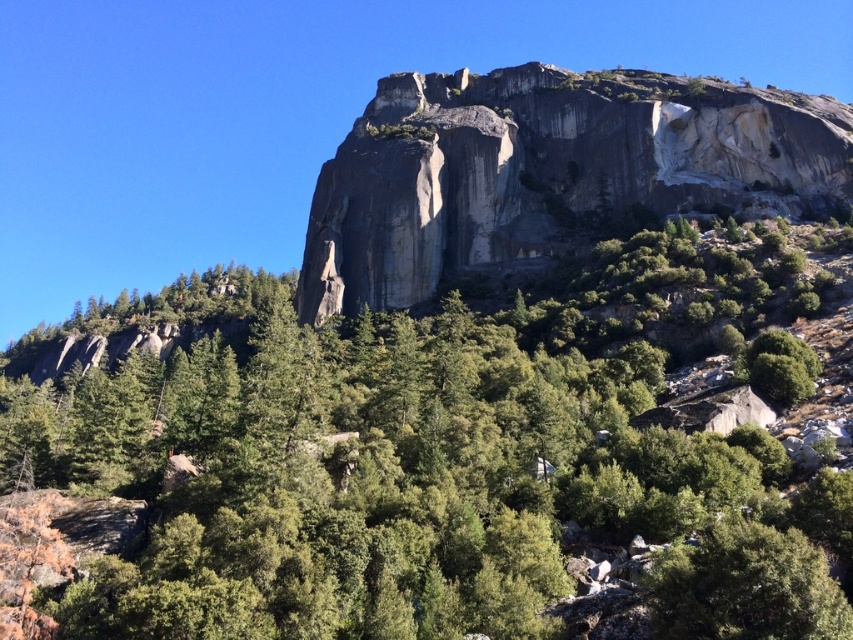
Question: Is green leafy tree at center further to the viewer compared to gray rock formation at upper center?

Choices:
 (A) yes
 (B) no

Answer: (B)

Question: Is green leafy tree at center closer to camera compared to gray rock formation at upper center?

Choices:
 (A) no
 (B) yes

Answer: (B)

Question: Which point is farther from the camera taking this photo?

Choices:
 (A) (843, 476)
 (B) (445, 209)

Answer: (B)

Question: Which point is farther from the camera taking this photo?

Choices:
 (A) (671, 186)
 (B) (775, 461)

Answer: (A)

Question: Is green leafy tree at center behind gray rock formation at upper center?

Choices:
 (A) yes
 (B) no

Answer: (B)